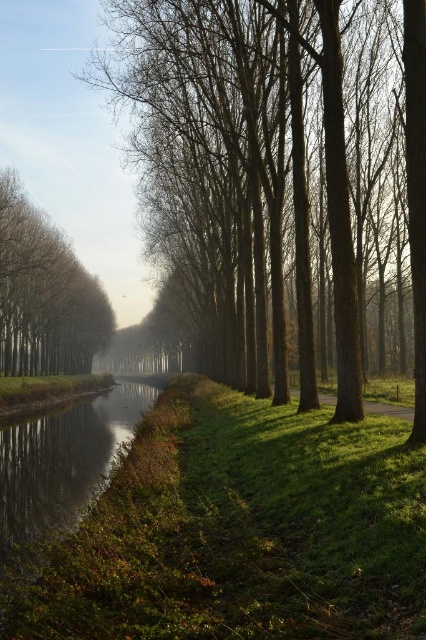
Consider the image. You are a hiker who wants to take a photo of the smooth bark trees at center and the green grassy path at center. Which object should you focus on first if you want to capture both in a single frame without moving the camera?

You should focus on the smooth bark trees at center first because they are larger than the green grassy path at center, so they will occupy more of the frame and ensure both are visible.

You are walking along the green grassy path at center and want to take a photo of the smooth bark trees at center. In which direction should you point your camera to capture both the path and the trees in the same frame?

You should point your camera to the left to capture both the green grassy path at center and the smooth bark trees at center, since the smooth bark trees at center are located to the left of the green grassy path at center.